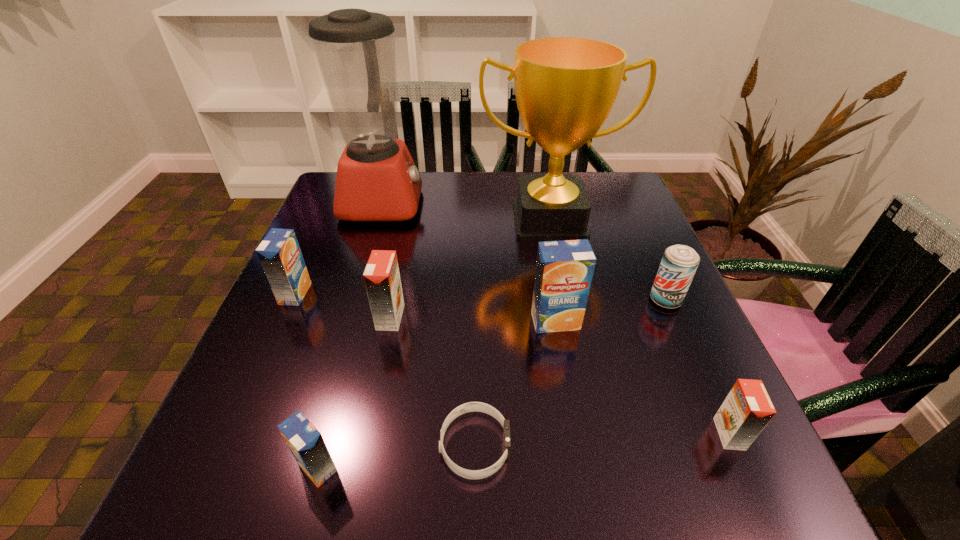
This screenshot has height=540, width=960. Find the location of `vacant point located between the nearer orange orange juice and the beer can`. vacant point located between the nearer orange orange juice and the beer can is located at coordinates (697, 367).

At what (x,y) coordinates should I click in order to perform the action: click on free area in between the wristband and the right orange orange juice. Please return your answer as a coordinate pair (x, y). The image size is (960, 540). Looking at the image, I should click on (602, 440).

At what (x,y) coordinates should I click in order to perform the action: click on vacant point located between the farther orange orange juice and the biggest blue orange_juice. Please return your answer as a coordinate pair (x, y). Looking at the image, I should click on (473, 319).

The image size is (960, 540). What are the coordinates of `vacant region between the beer can and the farthest blue orange_juice` in the screenshot? It's located at tap(480, 296).

This screenshot has height=540, width=960. I want to click on vacant space in between the third orange juice from left to right and the tallest orange juice, so click(473, 319).

The height and width of the screenshot is (540, 960). Identify the location of vacant area that lies between the smaller orange orange juice and the rightmost blue orange_juice. (642, 377).

Locate an element on the screen. free spot between the wristband and the leftmost blue orange_juice is located at coordinates (x=385, y=369).

Where is `vacant area that lies between the farthest blue orange_juice and the blender`? This screenshot has width=960, height=540. vacant area that lies between the farthest blue orange_juice and the blender is located at coordinates (339, 248).

Where is `vacant space that's between the left orange orange juice and the leftmost orange juice`? The image size is (960, 540). vacant space that's between the left orange orange juice and the leftmost orange juice is located at coordinates (343, 306).

Choose which object is the fourth nearest neighbor to the second nearest blue orange_juice. Please provide its 2D coordinates. Your answer should be formatted as a tuple, i.e. [(x, y)], where the tuple contains the x and y coordinates of a point satisfying the conditions above.

[(747, 409)]